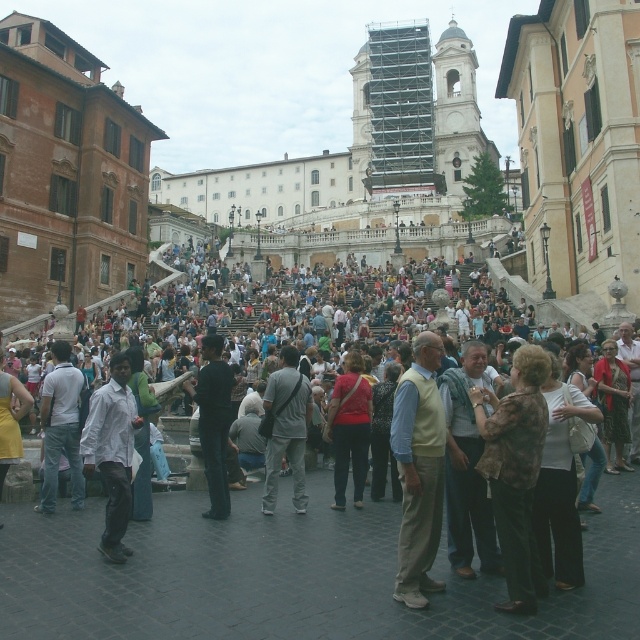
Who is more distant from viewer, (540, 493) or (358, 488)?

Positioned behind is point (358, 488).

Looking at this image, does brown textured coat at lower right have a smaller size compared to matte red sweater at center?

Incorrect, brown textured coat at lower right is not smaller in size than matte red sweater at center.

What do you see at coordinates (560, 484) in the screenshot? Image resolution: width=640 pixels, height=640 pixels. I see `brown textured coat at lower right` at bounding box center [560, 484].

Identify the location of brown textured coat at lower right. (560, 484).

Is brown textured shirt at lower right above brown textured coat at lower right?

Indeed, brown textured shirt at lower right is positioned over brown textured coat at lower right.

The image size is (640, 640). What do you see at coordinates (515, 472) in the screenshot? I see `brown textured shirt at lower right` at bounding box center [515, 472].

In order to click on brown textured shirt at lower right in this screenshot , I will do `click(515, 472)`.

Is matte red sweater at center above red shirt at center?

Indeed, matte red sweater at center is positioned over red shirt at center.

Identify the location of matte red sweater at center. [349, 428].

Where is `matte red sweater at center`? matte red sweater at center is located at coordinates (349, 428).